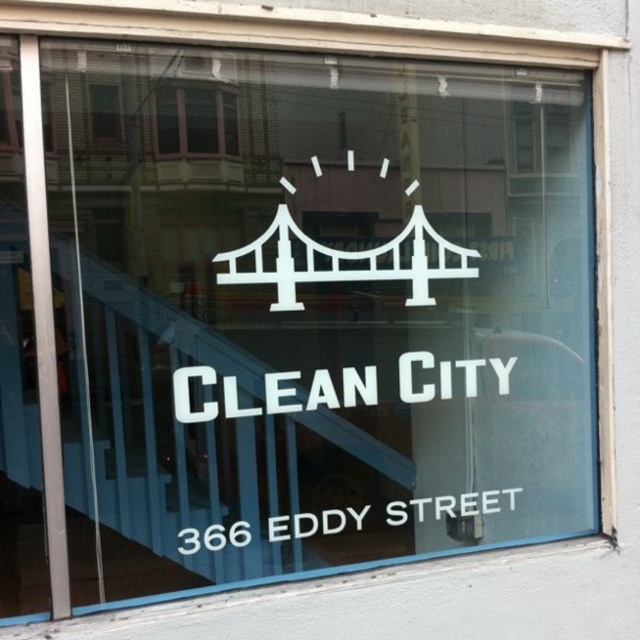
You are standing in front of the storefront window and want to place a new sticker exactly at the same position as the white vinyl sign at lower center. According to the coordinates provided, what are the coordinates where you should place the sticker?

The white vinyl sign at lower center is located at point (451, 506), so you should place the sticker at those coordinates.

In the scene shown: You are designing a new layout for the storefront window and need to ensure that the white matte sign at center and the white vinyl sign at lower center are visible from the street. Given their heights, which sign will appear taller when viewed from the sidewalk?

The white matte sign at center appears taller than the white vinyl sign at lower center because it has a greater height.